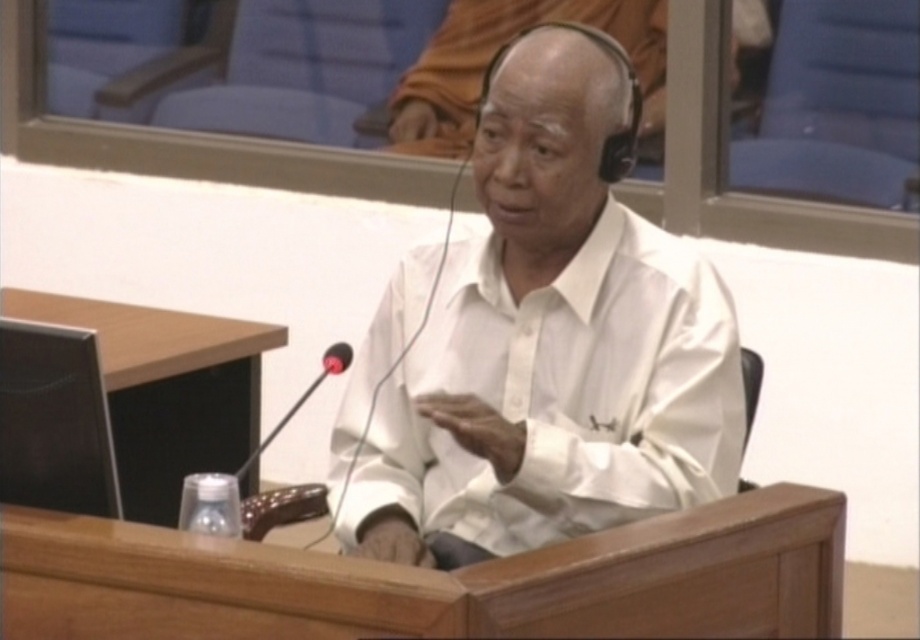
Is point (715, 280) positioned before point (332, 372)?

Yes, it is in front of point (332, 372).

What do you see at coordinates (552, 344) in the screenshot? I see `white matte shirt at center` at bounding box center [552, 344].

Locate an element on the screen. This screenshot has height=640, width=920. white matte shirt at center is located at coordinates (552, 344).

Image resolution: width=920 pixels, height=640 pixels. Find the location of `white matte shirt at center`. white matte shirt at center is located at coordinates (552, 344).

Can you confirm if white matte shirt at center is wider than black matte microphone at center?

Yes.

Looking at this image, who is higher up, white matte shirt at center or black matte microphone at center?

white matte shirt at center

Locate an element on the screen. The image size is (920, 640). white matte shirt at center is located at coordinates (552, 344).

This screenshot has height=640, width=920. What do you see at coordinates (301, 400) in the screenshot? I see `black matte microphone at center` at bounding box center [301, 400].

Is black matte microphone at center above black rubber microphone at center?

No, black matte microphone at center is not above black rubber microphone at center.

This screenshot has height=640, width=920. In order to click on black matte microphone at center in this screenshot , I will do `click(301, 400)`.

Where is `black matte microphone at center`? This screenshot has width=920, height=640. black matte microphone at center is located at coordinates (301, 400).